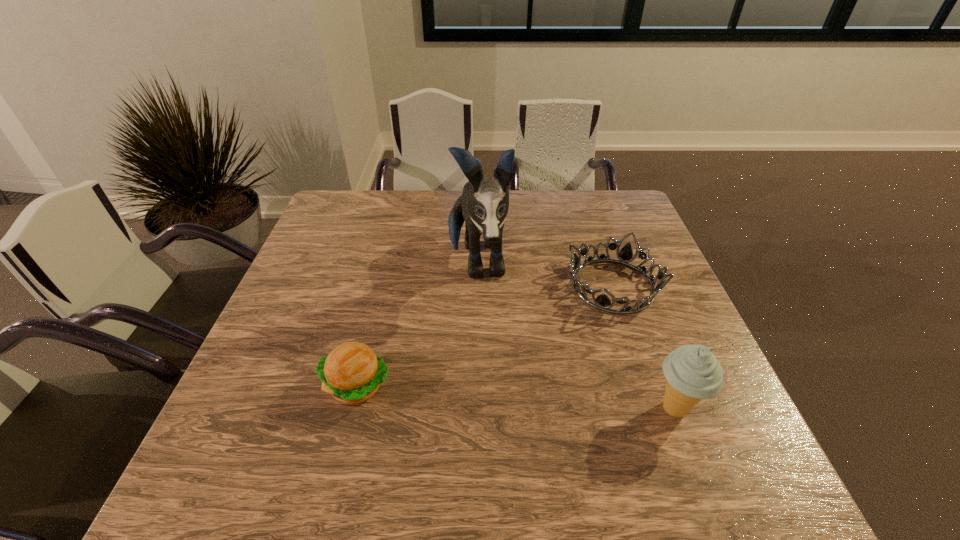
At what (x,y) coordinates should I click in order to perform the action: click on vacant space situated on the front-facing side of the shortest object. Please return your answer as a coordinate pair (x, y). This screenshot has width=960, height=540. Looking at the image, I should click on (578, 361).

Where is `free spot located on the front-facing side of the second object from left to right`? free spot located on the front-facing side of the second object from left to right is located at coordinates (490, 388).

Where is `free region located on the front-facing side of the second object from left to right`? This screenshot has height=540, width=960. free region located on the front-facing side of the second object from left to right is located at coordinates (484, 344).

You are a GUI agent. You are given a task and a screenshot of the screen. Output one action in this format:
    pyautogui.click(x=<x>, y=<y>)
    Task: Click on the free space located on the front-facing side of the second object from left to right
    The width and height of the screenshot is (960, 540).
    Given the screenshot: What is the action you would take?
    pyautogui.click(x=488, y=376)

This screenshot has height=540, width=960. What are the coordinates of `object that is at the far edge` in the screenshot? It's located at (484, 203).

At what (x,y) coordinates should I click in order to perform the action: click on hamburger that is at the near edge. Please return your answer as a coordinate pair (x, y). The width and height of the screenshot is (960, 540). Looking at the image, I should click on (352, 372).

The height and width of the screenshot is (540, 960). I want to click on icecream positioned at the near edge, so click(x=692, y=372).

Locate an element on the screen. This screenshot has width=960, height=540. icecream that is at the right edge is located at coordinates (692, 372).

Identify the location of tiara at the right edge. The height and width of the screenshot is (540, 960). (602, 302).

Identify the location of object that is at the near right corner. (692, 372).